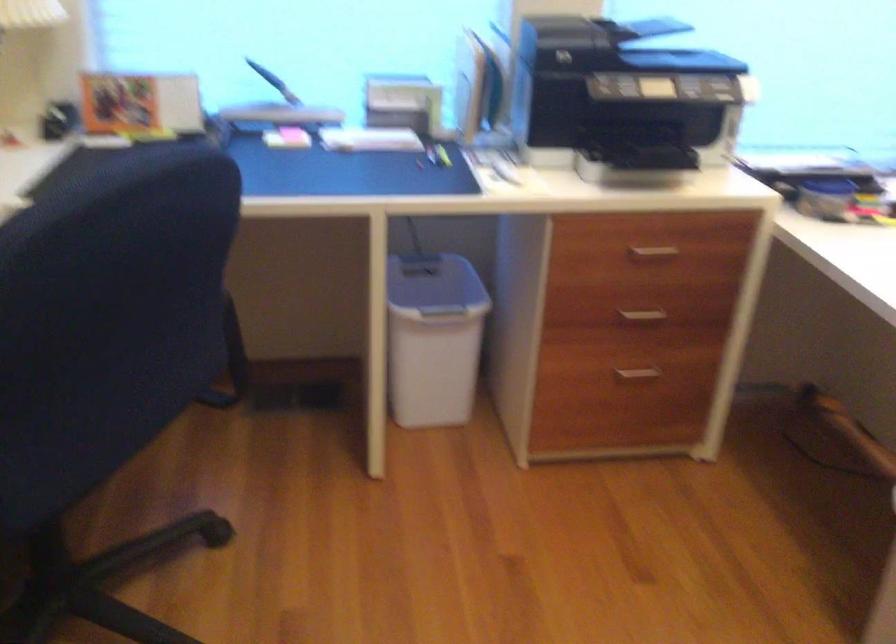
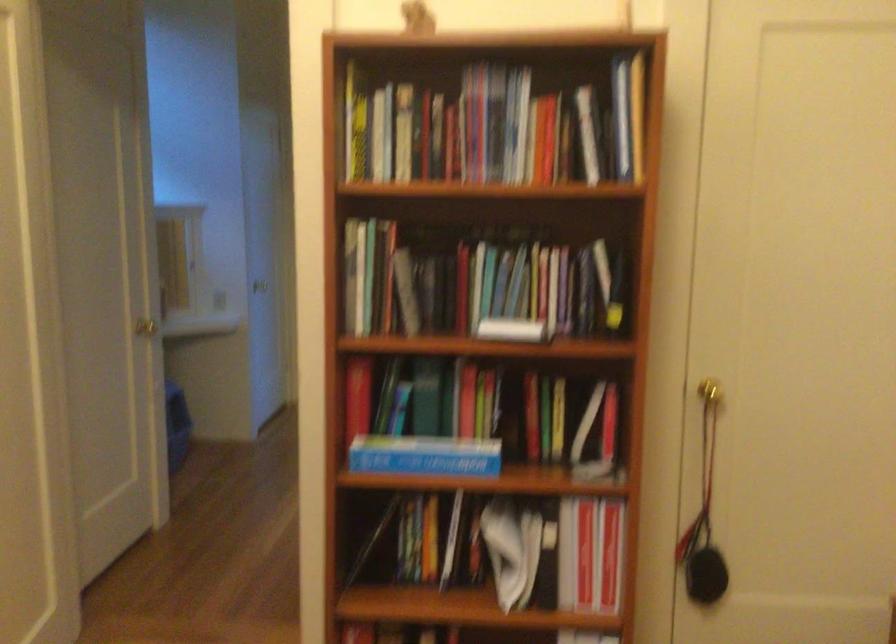
Question: How did the camera likely rotate?

Choices:
 (A) Left
 (B) Right
 (C) Up
 (D) Down

Answer: (B)